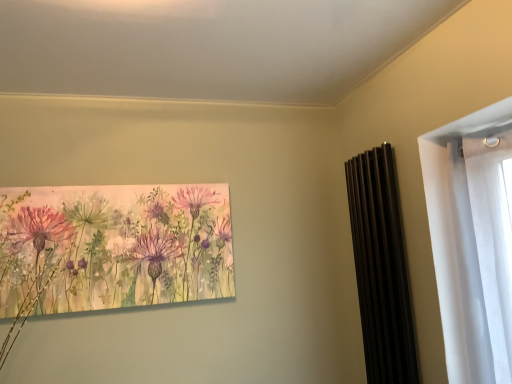
This screenshot has height=384, width=512. I want to click on black matte radiator at right, so [381, 268].

What do you see at coordinates (381, 268) in the screenshot? The width and height of the screenshot is (512, 384). I see `black matte radiator at right` at bounding box center [381, 268].

What is the approximate width of black matte radiator at right?

It is 3.90 inches.

What do you see at coordinates (114, 246) in the screenshot? The image size is (512, 384). I see `watercolor painting of flowers at center` at bounding box center [114, 246].

Locate an element on the screen. The height and width of the screenshot is (384, 512). watercolor painting of flowers at center is located at coordinates (114, 246).

Measure the distance between watercolor painting of flowers at center and camera.

They are 6.29 feet apart.

I want to click on black matte radiator at right, so click(x=381, y=268).

Considering the positions of objects watercolor painting of flowers at center and black matte radiator at right in the image provided, who is more to the right, watercolor painting of flowers at center or black matte radiator at right?

Positioned to the right is black matte radiator at right.

In the image, is watercolor painting of flowers at center positioned in front of or behind black matte radiator at right?

Visually, watercolor painting of flowers at center is located behind black matte radiator at right.

Is point (151, 243) in front of point (392, 273)?

No, (151, 243) is further to viewer.

From the image's perspective, is watercolor painting of flowers at center located above or below black matte radiator at right?

Based on their image positions, watercolor painting of flowers at center is located above black matte radiator at right.

From a real-world perspective, is watercolor painting of flowers at center located higher than black matte radiator at right?

Yes, from a real-world perspective, watercolor painting of flowers at center is above black matte radiator at right.

In the scene shown: Between watercolor painting of flowers at center and black matte radiator at right, which one has larger width?

Wider between the two is black matte radiator at right.

Considering the sizes of watercolor painting of flowers at center and black matte radiator at right in the image, is watercolor painting of flowers at center taller or shorter than black matte radiator at right?

Clearly, watercolor painting of flowers at center is shorter compared to black matte radiator at right.

Considering the sizes of objects watercolor painting of flowers at center and black matte radiator at right in the image provided, who is bigger, watercolor painting of flowers at center or black matte radiator at right?

Bigger between the two is black matte radiator at right.

Is watercolor painting of flowers at center positioned beyond the bounds of black matte radiator at right?

Absolutely, watercolor painting of flowers at center is external to black matte radiator at right.

Are watercolor painting of flowers at center and black matte radiator at right beside each other?

No, watercolor painting of flowers at center is not next to black matte radiator at right.

Could you tell me if watercolor painting of flowers at center is turned towards black matte radiator at right?

No, watercolor painting of flowers at center is not turned towards black matte radiator at right.

How different are the orientations of watercolor painting of flowers at center and black matte radiator at right in degrees?

They differ by 90 degrees in their facing directions.

Find the location of a particular element. This screenshot has height=384, width=512. flower that appears behind the black matte radiator at right is located at coordinates (114, 246).

Considering the positions of objects black matte radiator at right and watercolor painting of flowers at center in the image provided, who is more to the right, black matte radiator at right or watercolor painting of flowers at center?

From the viewer's perspective, black matte radiator at right appears more on the right side.

Which object is closer to the camera, black matte radiator at right or watercolor painting of flowers at center?

black matte radiator at right.

Which point is more forward, (365,303) or (159,189)?

The point (365,303) is closer to the camera.

From the image's perspective, which is below, black matte radiator at right or watercolor painting of flowers at center?

From the image's view, black matte radiator at right is below.

From a real-world perspective, is black matte radiator at right on top of watercolor painting of flowers at center?

No.

Is black matte radiator at right wider or thinner than watercolor painting of flowers at center?

Considering their sizes, black matte radiator at right looks broader than watercolor painting of flowers at center.

Does black matte radiator at right have a greater height compared to watercolor painting of flowers at center?

Indeed, black matte radiator at right has a greater height compared to watercolor painting of flowers at center.

Is black matte radiator at right bigger or smaller than watercolor painting of flowers at center?

Considering their sizes, black matte radiator at right takes up more space than watercolor painting of flowers at center.

Is black matte radiator at right completely or partially outside of watercolor painting of flowers at center?

Indeed, black matte radiator at right is completely outside watercolor painting of flowers at center.

Is black matte radiator at right far from watercolor painting of flowers at center?

Yes, black matte radiator at right is far from watercolor painting of flowers at center.

Does black matte radiator at right turn towards watercolor painting of flowers at center?

Yes, black matte radiator at right is oriented towards watercolor painting of flowers at center.

What's the angular difference between black matte radiator at right and watercolor painting of flowers at center's facing directions?

90 degrees separate the facing orientations of black matte radiator at right and watercolor painting of flowers at center.

Where is `radiator below the watercolor painting of flowers at center (from a real-world perspective)`? This screenshot has height=384, width=512. radiator below the watercolor painting of flowers at center (from a real-world perspective) is located at coordinates (381, 268).

Identify the location of flower that is on the left side of black matte radiator at right. (114, 246).

The width and height of the screenshot is (512, 384). Find the location of `flower located above the black matte radiator at right (from the image's perspective)`. flower located above the black matte radiator at right (from the image's perspective) is located at coordinates (114, 246).